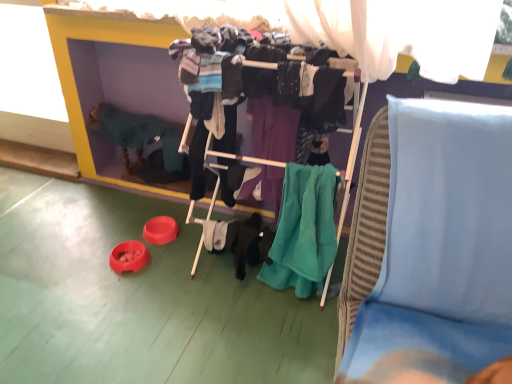
This screenshot has height=384, width=512. Describe the element at coordinates (137, 134) in the screenshot. I see `knitted green sweater at left` at that location.

The image size is (512, 384). In order to click on teal fabric clothes at center in this screenshot , I will do `click(263, 74)`.

You are a GUI agent. You are given a task and a screenshot of the screen. Output one action in this format:
    pyautogui.click(x=<x>, y=<y>)
    Task: Click on the light blue fabric at upper right
    The image size is (512, 384).
    Given the screenshot: What is the action you would take?
    pyautogui.click(x=440, y=249)

Between point (310, 221) and point (485, 290), which one is positioned behind?

Positioned behind is point (310, 221).

Is teal soft towel at center located outside light blue fabric at upper right?

Indeed, teal soft towel at center is completely outside light blue fabric at upper right.

Does teal soft towel at center lie in front of light blue fabric at upper right?

No, it is behind light blue fabric at upper right.

Is teal soft towel at center smaller than light blue fabric at upper right?

Correct, teal soft towel at center occupies less space than light blue fabric at upper right.

From the image's perspective, is knitted green sweater at left below teal soft towel at center?

Incorrect, from the image's perspective, knitted green sweater at left is higher than teal soft towel at center.

Where is `person behind the teal soft towel at center`? person behind the teal soft towel at center is located at coordinates (137, 134).

Is knitted green sweater at left with teal soft towel at center?

No.

Could you tell me if light blue fabric at upper right is facing knitted green sweater at left?

No, light blue fabric at upper right is not aimed at knitted green sweater at left.

Looking at the image, does light blue fabric at upper right seem bigger or smaller compared to knitted green sweater at left?

Clearly, light blue fabric at upper right is larger in size than knitted green sweater at left.

Does light blue fabric at upper right have a greater height compared to knitted green sweater at left?

Indeed, light blue fabric at upper right has a greater height compared to knitted green sweater at left.

In the scene shown: Which object is positioned more to the left, light blue fabric at upper right or knitted green sweater at left?

knitted green sweater at left is more to the left.

Does light blue fabric at upper right turn towards teal fabric clothes at center?

No, light blue fabric at upper right is not turned towards teal fabric clothes at center.

In terms of height, does light blue fabric at upper right look taller or shorter compared to teal fabric clothes at center?

light blue fabric at upper right is shorter than teal fabric clothes at center.

From a real-world perspective, is light blue fabric at upper right positioned above or below teal fabric clothes at center?

light blue fabric at upper right is below teal fabric clothes at center.

Is point (472, 107) closer to viewer compared to point (318, 89)?

Yes, it is.

Is teal fabric clothes at center oriented towards light blue fabric at upper right?

No, teal fabric clothes at center is not aimed at light blue fabric at upper right.

How distant is teal fabric clothes at center from light blue fabric at upper right?

A distance of 20.58 inches exists between teal fabric clothes at center and light blue fabric at upper right.

Is teal fabric clothes at center positioned far away from light blue fabric at upper right?

No.

How many degrees apart are the facing directions of teal fabric clothes at center and light blue fabric at upper right?

The angular difference between teal fabric clothes at center and light blue fabric at upper right is 5.03 degrees.

Is light blue fabric at upper right positioned far away from teal soft towel at center?

No, there isn't a large distance between light blue fabric at upper right and teal soft towel at center.

Does light blue fabric at upper right turn towards teal soft towel at center?

No.

From a real-world perspective, is light blue fabric at upper right physically located above or below teal soft towel at center?

Clearly, from a real-world perspective, light blue fabric at upper right is above teal soft towel at center.

Is the position of knitted green sweater at left less distant than that of teal fabric clothes at center?

No.

Considering the sizes of objects knitted green sweater at left and teal fabric clothes at center in the image provided, who is shorter, knitted green sweater at left or teal fabric clothes at center?

With less height is knitted green sweater at left.

Does point (151, 137) appear closer or farther from the camera than point (182, 54)?

Point (151, 137) is farther from the camera than point (182, 54).

Consider the image. From the image's perspective, which one is positioned lower, knitted green sweater at left or teal fabric clothes at center?

From the image's view, teal fabric clothes at center is below.

Image resolution: width=512 pixels, height=384 pixels. I want to click on furniture above the teal soft towel at center (from a real-world perspective), so click(x=440, y=249).

Locate an element on the screen. This screenshot has width=512, height=384. clothing that is under the knitted green sweater at left (from a real-world perspective) is located at coordinates (303, 230).

Looking at the image, which one is located closer to light blue fabric at upper right, teal fabric clothes at center or teal soft towel at center?

Based on the image, teal soft towel at center appears to be nearer to light blue fabric at upper right.

Looking at the image, which one is located closer to teal soft towel at center, light blue fabric at upper right or teal fabric clothes at center?

teal fabric clothes at center.

From the image, which object appears to be nearer to knitted green sweater at left, teal soft towel at center or light blue fabric at upper right?

teal soft towel at center is positioned closer to the anchor knitted green sweater at left.

Based on their spatial positions, is teal fabric clothes at center or light blue fabric at upper right further from teal soft towel at center?

light blue fabric at upper right lies further to teal soft towel at center than the other object.

Looking at the image, which one is located closer to teal soft towel at center, light blue fabric at upper right or knitted green sweater at left?

The object closer to teal soft towel at center is light blue fabric at upper right.

Considering their positions, is teal soft towel at center positioned closer to teal fabric clothes at center than light blue fabric at upper right?

Based on the image, teal soft towel at center appears to be nearer to teal fabric clothes at center.

Looking at the image, which one is located further to knitted green sweater at left, light blue fabric at upper right or teal fabric clothes at center?

light blue fabric at upper right.

Estimate the real-world distances between objects in this image. Which object is further from light blue fabric at upper right, teal soft towel at center or knitted green sweater at left?

Among the two, knitted green sweater at left is located further to light blue fabric at upper right.

I want to click on clothing positioned between light blue fabric at upper right and knitted green sweater at left from near to far, so (x=303, y=230).

At what (x,y) coordinates should I click in order to perform the action: click on clothing between teal fabric clothes at center and knitted green sweater at left along the z-axis. Please return your answer as a coordinate pair (x, y). This screenshot has width=512, height=384. Looking at the image, I should click on (303, 230).

I want to click on closet positioned between light blue fabric at upper right and knitted green sweater at left from near to far, so click(263, 74).

Locate an element on the screen. closet located between light blue fabric at upper right and teal soft towel at center in the depth direction is located at coordinates (263, 74).